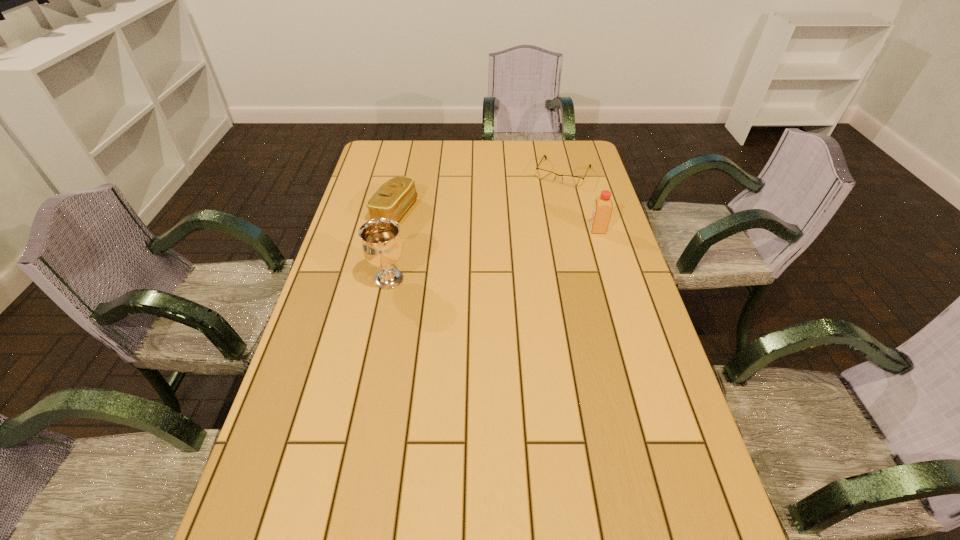
This screenshot has height=540, width=960. I want to click on vacant region between the second shortest object and the farthest object, so click(479, 192).

The image size is (960, 540). Find the location of `free space between the nearest object and the orange juice`. free space between the nearest object and the orange juice is located at coordinates (493, 254).

Find the location of a particular element. Image resolution: width=960 pixels, height=540 pixels. free area in between the nearest object and the spectacles is located at coordinates (476, 226).

Find the location of a particular element. The height and width of the screenshot is (540, 960). free space that is in between the third tallest object and the third shortest object is located at coordinates (496, 221).

Locate an element on the screen. Image resolution: width=960 pixels, height=540 pixels. free space between the second tallest object and the shortest object is located at coordinates (581, 201).

Where is `free space between the orange juice and the farthest object`? Image resolution: width=960 pixels, height=540 pixels. free space between the orange juice and the farthest object is located at coordinates (581, 201).

Locate an element on the screen. object that stands as the closest to the shortest object is located at coordinates (603, 205).

This screenshot has height=540, width=960. Find the location of `object that is the closest one to the clutch bag`. object that is the closest one to the clutch bag is located at coordinates (382, 246).

Find the location of a particular element. vacant region that satisfies the following two spatial constraints: 1. on the front side of the spectacles; 2. on the front and back of the third shortest object is located at coordinates (578, 230).

You are a GUI agent. You are given a task and a screenshot of the screen. Output one action in this format:
    pyautogui.click(x=<x>, y=<y>)
    Task: Click on the free spot that satisfies the following two spatial constraints: 1. on the front side of the shortest object; 2. on the front and back of the orange juice
    The width and height of the screenshot is (960, 540).
    Given the screenshot: What is the action you would take?
    pyautogui.click(x=578, y=230)